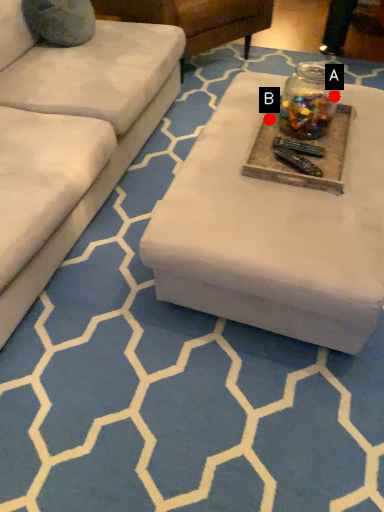
Question: Two points are circled on the image, labeled by A and B beside each circle. Which of the following is the closest to the observer?

Choices:
 (A) A is closer
 (B) B is closer

Answer: (B)